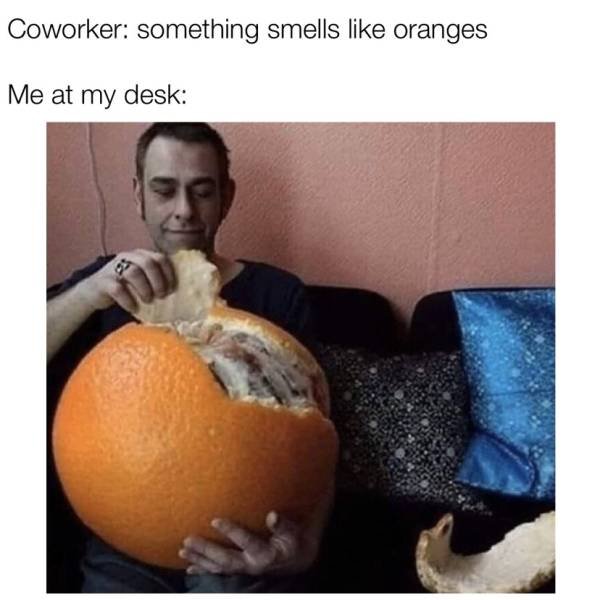
Locate an element on the screen. The height and width of the screenshot is (600, 600). black pillow is located at coordinates (423, 415).